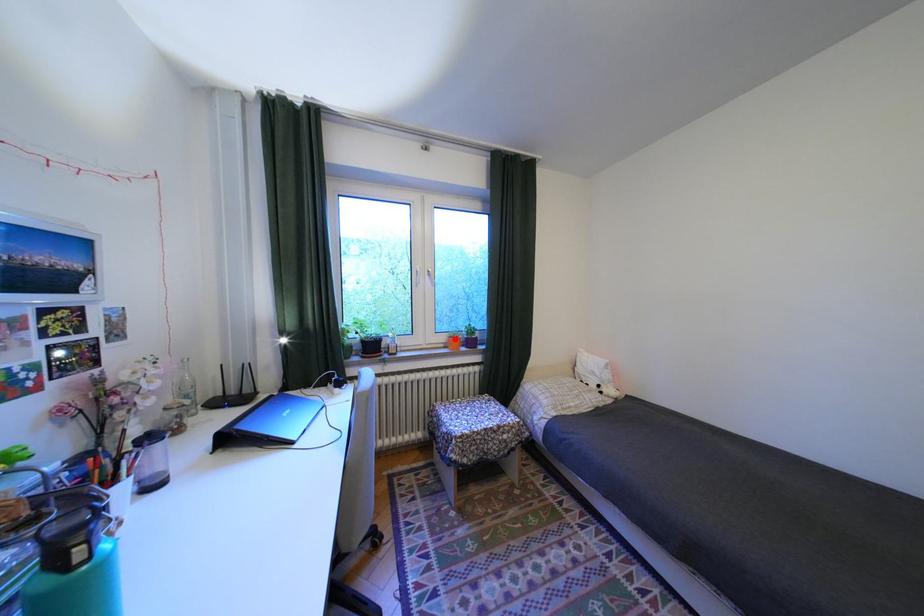
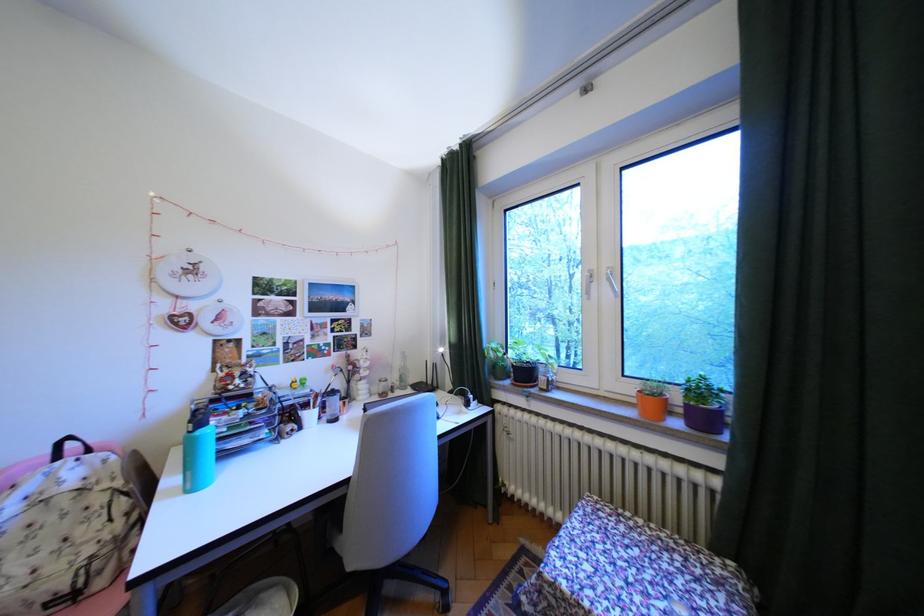
Find the pixel in the second image that matches the highlighted location in the first image.

(641, 390)